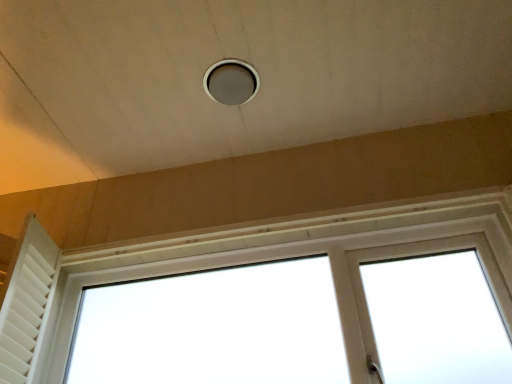
Question: Based on their positions, is matte gray hole at center located to the left or right of white matte shutter at left?

Choices:
 (A) left
 (B) right

Answer: (B)

Question: From the image's perspective, is matte gray hole at center located above or below white matte shutter at left?

Choices:
 (A) below
 (B) above

Answer: (B)

Question: Considering the real-world distances, which object is closest to the matte gray hole at center?

Choices:
 (A) white matte shutter at left
 (B) white plastic window at center

Answer: (B)

Question: Which object is the closest to the matte gray hole at center?

Choices:
 (A) white plastic window at center
 (B) white matte shutter at left

Answer: (A)